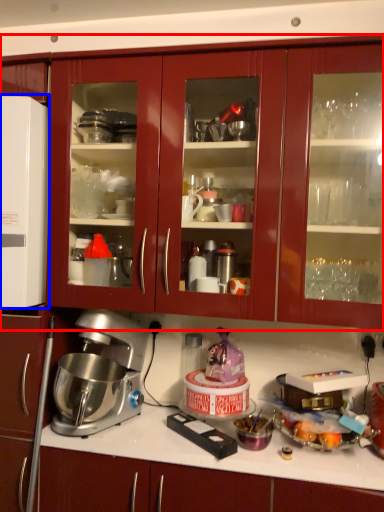
Question: Which object appears closest to the camera in this image, cabinetry (highlighted by a red box) or appliance (highlighted by a blue box)?

Choices:
 (A) cabinetry
 (B) appliance

Answer: (A)